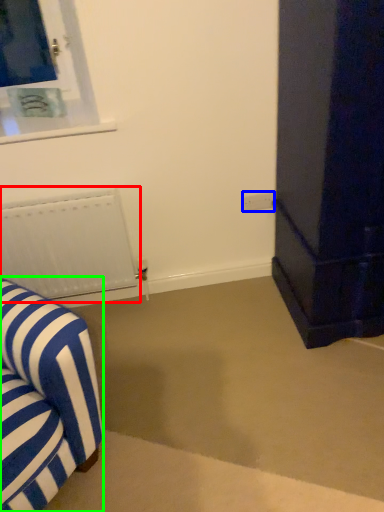
Question: Based on their relative distances, which object is farther from radiator (highlighted by a red box)? Choose from electric outlet (highlighted by a blue box) and furniture (highlighted by a green box).

Choices:
 (A) electric outlet
 (B) furniture

Answer: (A)